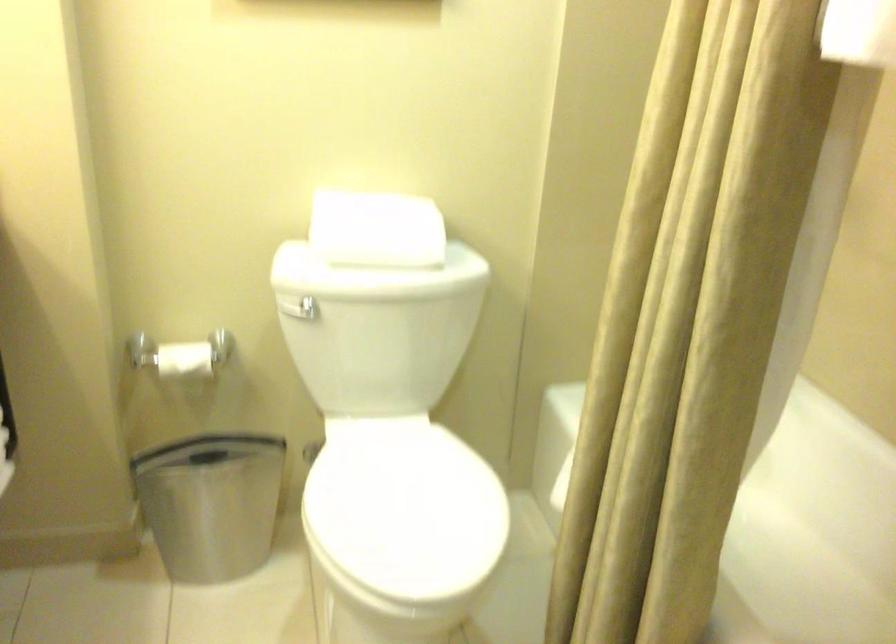
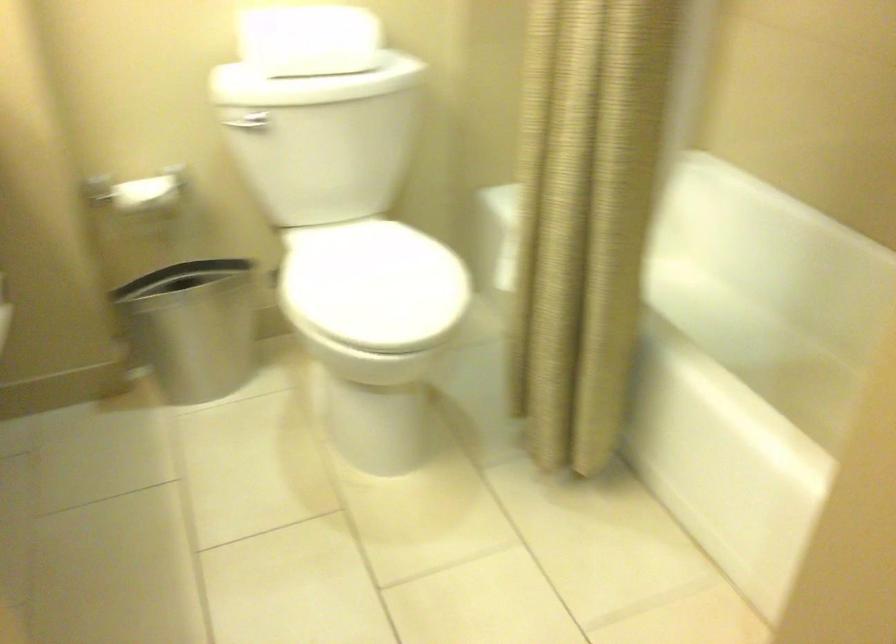
Question: Based on the continuous images, in which direction is the camera rotating? Reply with the corresponding letter.

Choices:
 (A) Left
 (B) Right
 (C) Up
 (D) Down

Answer: (D)